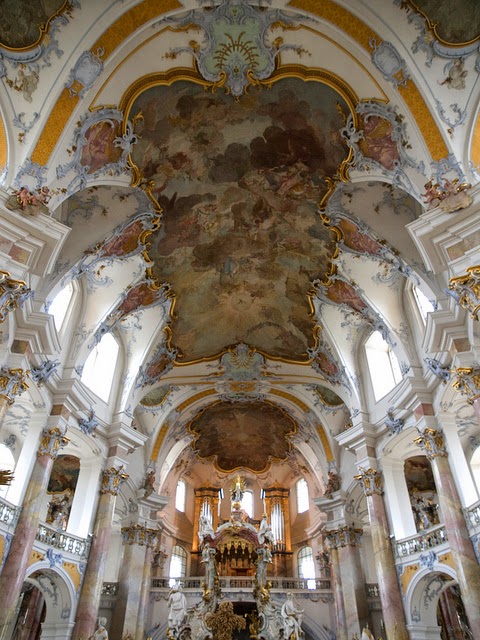
This screenshot has height=640, width=480. Identify the location of candle. (237, 483).